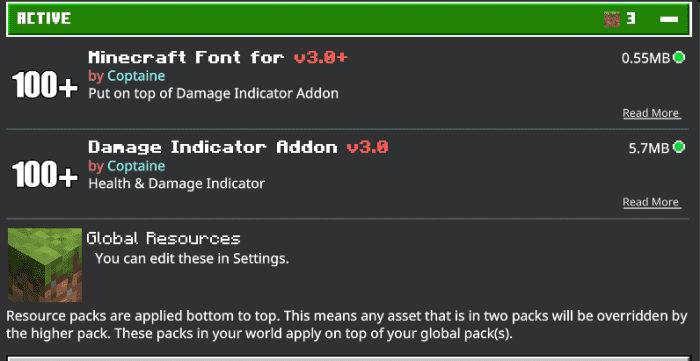
This screenshot has width=700, height=361. Identify the location of top left small brown box with green top. (609, 16).